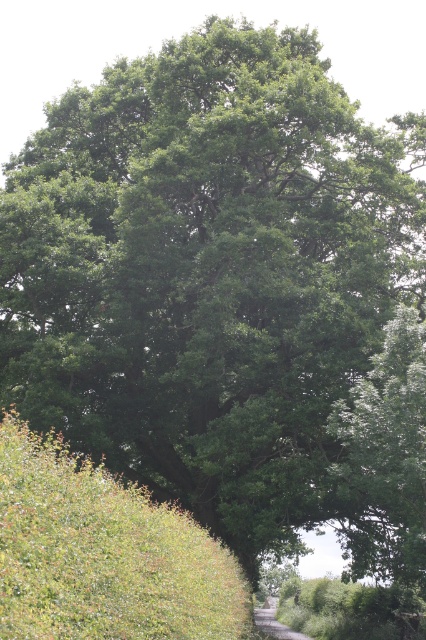
Question: Among these points, which one is nearest to the camera?

Choices:
 (A) (281, 627)
 (B) (161, 529)

Answer: (B)

Question: Is green leafy hedge at lower left bigger than gravel path at center?

Choices:
 (A) no
 (B) yes

Answer: (B)

Question: Which of the following is the farthest from the observer?

Choices:
 (A) green leafy hedge at lower left
 (B) gravel path at center

Answer: (B)

Question: Observing the image, what is the correct spatial positioning of green leafy hedge at lower left in reference to gravel path at center?

Choices:
 (A) right
 (B) left

Answer: (B)

Question: Does green leafy hedge at lower left have a larger size compared to gravel path at center?

Choices:
 (A) no
 (B) yes

Answer: (B)

Question: Which point is farther to the camera?

Choices:
 (A) green leafy hedge at lower left
 (B) gravel path at center

Answer: (B)